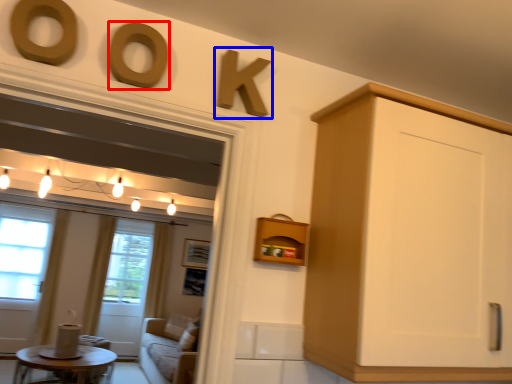
Question: Which point is closer to the camera, oval (highlighted by a red box) or number (highlighted by a blue box)?

Choices:
 (A) oval
 (B) number

Answer: (A)